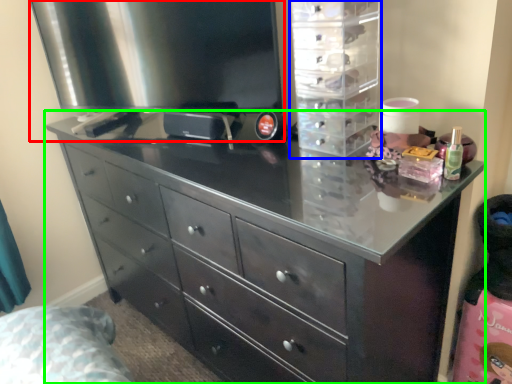
Question: Which is nearer to the appliance (highlighted by a red box)? cabinet (highlighted by a blue box) or chest of drawers (highlighted by a green box).

Choices:
 (A) cabinet
 (B) chest of drawers

Answer: (A)